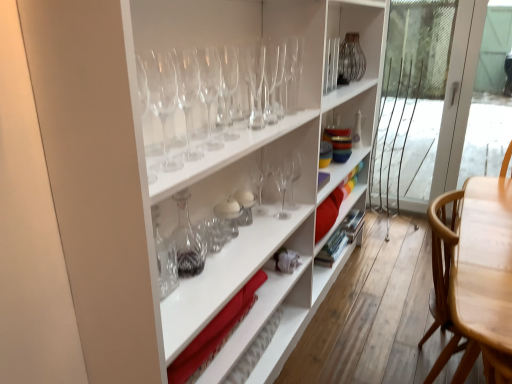
Question: Does clear glass wine glass at upper center, the seventh wine glass when ordered from front to back, have a greater width compared to transparent glass wine glass at upper center, which is the fifth wine glass in back-to-front order?

Choices:
 (A) no
 (B) yes

Answer: (A)

Question: Is clear glass wine glass at upper center, which is counted as the 4th wine glass, starting from the back, at the left side of transparent glass wine glass at upper center, which is the fifth wine glass in back-to-front order?

Choices:
 (A) yes
 (B) no

Answer: (B)

Question: Is clear glass wine glass at upper center, the seventh wine glass when ordered from front to back, positioned behind transparent glass wine glass at upper center, which is the fifth wine glass in back-to-front order?

Choices:
 (A) no
 (B) yes

Answer: (B)

Question: From the image's perspective, does clear glass wine glass at upper center, the seventh wine glass when ordered from front to back, appear lower than transparent glass wine glass at upper center, the sixth wine glass when ordered from front to back?

Choices:
 (A) no
 (B) yes

Answer: (A)

Question: Considering the relative sizes of clear glass wine glass at upper center, the seventh wine glass when ordered from front to back, and transparent glass wine glass at upper center, the sixth wine glass when ordered from front to back, in the image provided, is clear glass wine glass at upper center, the seventh wine glass when ordered from front to back, bigger than transparent glass wine glass at upper center, the sixth wine glass when ordered from front to back,?

Choices:
 (A) yes
 (B) no

Answer: (B)

Question: Is clear glass wine glass at upper center, which is counted as the 4th wine glass, starting from the back, to the right of transparent glass wine glass at upper center, which is the fifth wine glass in back-to-front order, from the viewer's perspective?

Choices:
 (A) no
 (B) yes

Answer: (B)

Question: Is clear glass decanter at center facing away from transparent glass wine glass at center, which is the fifth wine glass from front to back?

Choices:
 (A) yes
 (B) no

Answer: (B)

Question: From a real-world perspective, is clear glass decanter at center under transparent glass wine glass at center, which is the fifth wine glass from front to back?

Choices:
 (A) no
 (B) yes

Answer: (B)

Question: Is clear glass decanter at center smaller than transparent glass wine glass at center, which is the fifth wine glass from front to back?

Choices:
 (A) no
 (B) yes

Answer: (A)

Question: Is clear glass decanter at center to the right of transparent glass wine glass at center, which is the fifth wine glass from front to back, from the viewer's perspective?

Choices:
 (A) no
 (B) yes

Answer: (A)

Question: Is clear glass decanter at center far away from transparent glass wine glass at center, arranged as the sixth wine glass when viewed from the back?

Choices:
 (A) no
 (B) yes

Answer: (A)

Question: Is clear glass decanter at center next to transparent glass wine glass at center, which is the fifth wine glass from front to back?

Choices:
 (A) yes
 (B) no

Answer: (B)

Question: Considering the relative positions of transparent glass wine glasses at upper center, acting as the 2th wine glass starting from the front, and transparent glass wine glass at upper center, arranged as the 4th wine glass when viewed from the front, in the image provided, is transparent glass wine glasses at upper center, acting as the 2th wine glass starting from the front, in front of transparent glass wine glass at upper center, arranged as the 4th wine glass when viewed from the front,?

Choices:
 (A) yes
 (B) no

Answer: (A)